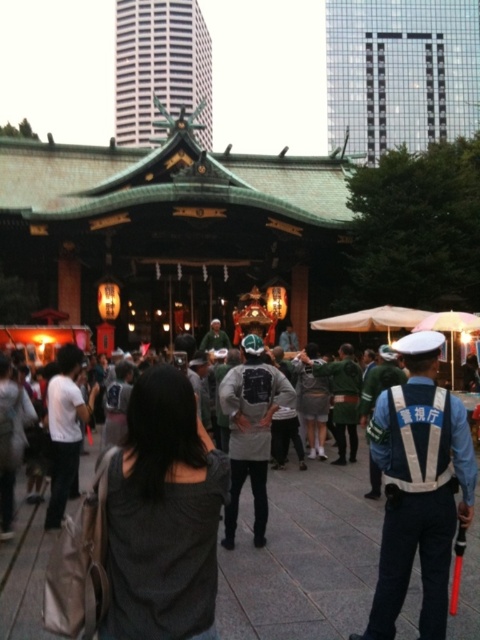
You are a photographer standing in the middle of the dark gray fabric crowd at center. You want to take a photo of the green glazed tile temple at upper center. Is the temple currently visible from your position?

The dark gray fabric crowd at center is positioned under the green glazed tile temple at upper center, so the crowd is below the temple. Since the crowd is under the temple, the temple should be visible above them. Therefore, yes, the green glazed tile temple at upper center is visible from your position in the crowd.

You are standing in the crowd at the festival and want to take a photo of the shrine. There are two points marked in the scene. One is at coordinates point (156, 0) and the other at point (72, 388). Which point is closer to you so you can position yourself there for a better shot?

Point (156, 0) is closer to you, so positioning yourself there would provide a better vantage point for taking the photo of the shrine.

You are standing at the entrance of the shrine and want to take a photo of the dark gray fabric crowd at center without any obstructions. Since the umbrellas are to the right of the shrine, where should you position yourself to ensure the umbrellas don not block your view?

You should position yourself to the left side of the shrine to avoid the umbrellas on the right, ensuring a clear view of the dark gray fabric crowd at center.